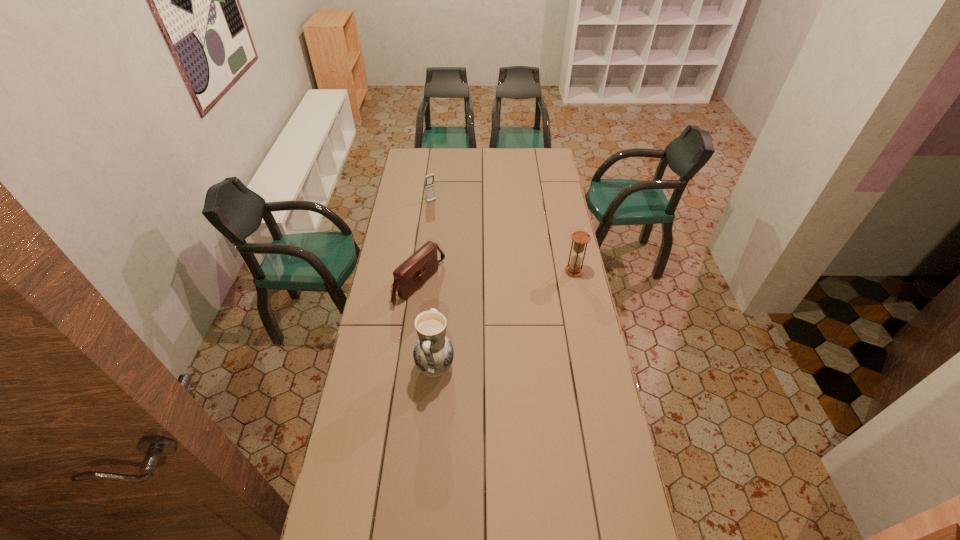
Choose which object is the third nearest neighbor to the shoulder bag. Please provide its 2D coordinates. Your answer should be formatted as a tuple, i.e. [(x, y)], where the tuple contains the x and y coordinates of a point satisfying the conditions above.

[(580, 238)]

Locate an element on the screen. This screenshot has width=960, height=540. vacant area in the image that satisfies the following two spatial constraints: 1. on the front side of the cellular telephone; 2. on either side of the pottery is located at coordinates (410, 367).

Find the location of `vacant space that satisfies the following two spatial constraints: 1. on the front side of the tallest object; 2. on either side of the cellular telephone`. vacant space that satisfies the following two spatial constraints: 1. on the front side of the tallest object; 2. on either side of the cellular telephone is located at coordinates (410, 367).

At what (x,y) coordinates should I click in order to perform the action: click on vacant area that satisfies the following two spatial constraints: 1. on the front side of the farthest object; 2. on the left side of the rightmost object. Please return your answer as a coordinate pair (x, y). The height and width of the screenshot is (540, 960). Looking at the image, I should click on (422, 271).